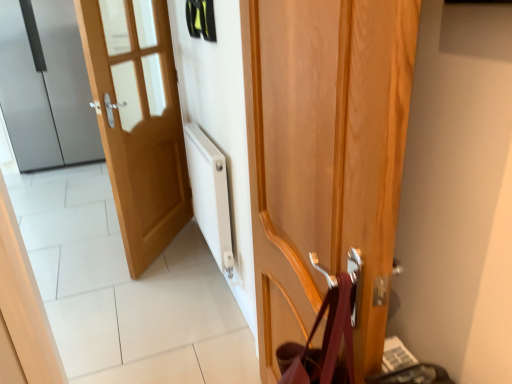
Question: From the image's perspective, is light wood door at left, which appears as the 2th door when viewed from the back, positioned above or below wooden door at center, arranged as the 3th door when viewed from the back?

Choices:
 (A) below
 (B) above

Answer: (B)

Question: Is light wood door at left, which appears as the second door when viewed from the front, wider or thinner than wooden door at center, marked as the first door in a right-to-left arrangement?

Choices:
 (A) wide
 (B) thin

Answer: (B)

Question: Which of these objects is positioned farthest from the light wood door at left, which appears as the second door when viewed from the front?

Choices:
 (A) wooden door at center, marked as the first door in a front-to-back arrangement
 (B) satin silver refrigerator at left, which is the 1th door from left to right

Answer: (B)

Question: Which object is the farthest from the satin silver refrigerator at left, marked as the third door in a front-to-back arrangement?

Choices:
 (A) light wood door at left, positioned as the 2th door in left-to-right order
 (B) wooden door at center, which ranks as the 3th door in left-to-right order

Answer: (B)